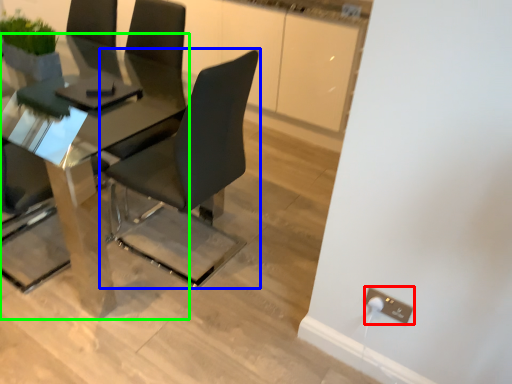
Question: Which object is the farthest from electric outlet (highlighted by a red box)? Choose among these: chair (highlighted by a blue box) or table (highlighted by a green box).

Choices:
 (A) chair
 (B) table

Answer: (B)